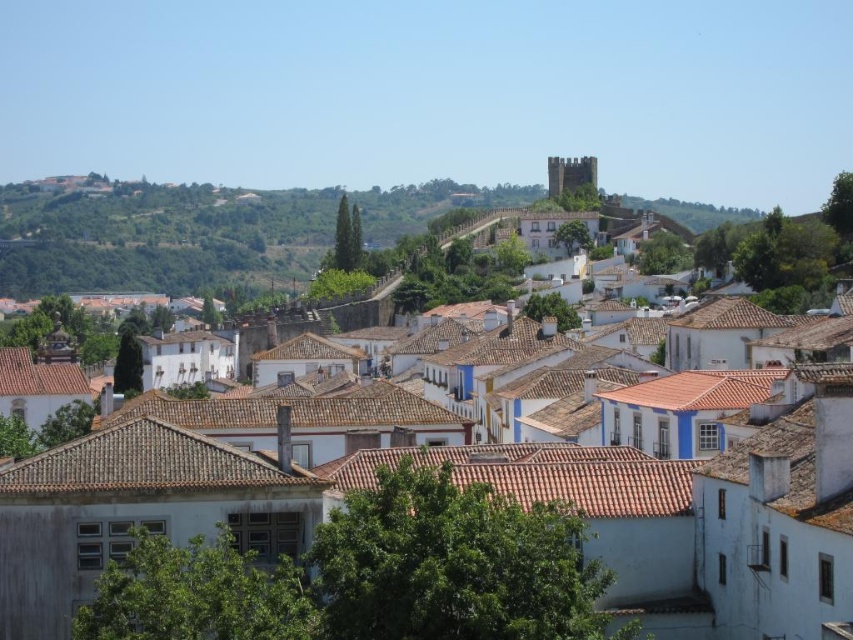
You are standing in the historic town and want to take a photo of the white tile roof at upper center without the green grassy hillside at upper left blocking it. How should you adjust your position?

Move to the right so the white tile roof at upper center is no longer under the green grassy hillside at upper left.

You are a tourist standing at the entrance of the historic town and want to take a photo that includes both the white tile roof at upper center and the green grassy hillside at upper left. Based on their positions, which one should you pan your camera towards first to ensure both are in frame?

The white tile roof at upper center is to the right of the green grassy hillside at upper left. To include both in the frame, you should pan your camera towards the green grassy hillside at upper left first, as it is on the left side, allowing you to adjust the view to capture both objects.

You are a drone operator tasked with capturing aerial footage of the historic town. Your drone has a maximum flight range of 50 meters. You need to fly from the white tile roof at upper center to the green grassy hillside at upper left. Will your drone be able to reach the hillside without exceeding its range?

The white tile roof at upper center is 55.11 meters away from the green grassy hillside at upper left. Since the drone has a maximum flight range of 50 meters, it will not be able to reach the hillside without exceeding its range.